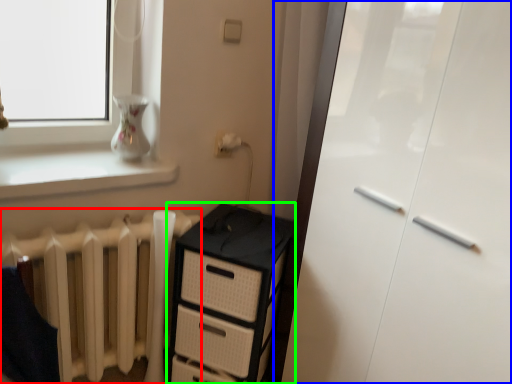
Question: Estimate the real-world distances between objects in this image. Which object is closer to radiator (highlighted by a red box), screen door (highlighted by a blue box) or chest of drawers (highlighted by a green box)?

Choices:
 (A) screen door
 (B) chest of drawers

Answer: (B)